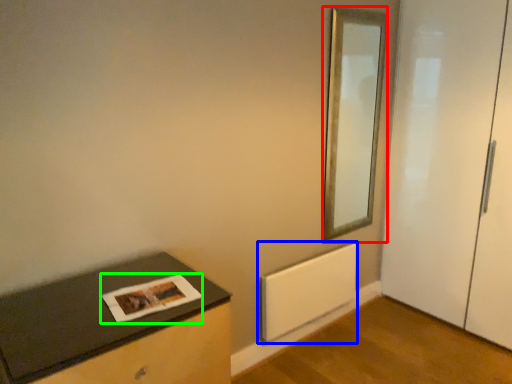
Question: Considering the real-world distances, which object is closest to mirror (highlighted by a red box)? radiator (highlighted by a blue box) or magazine (highlighted by a green box).

Choices:
 (A) radiator
 (B) magazine

Answer: (A)